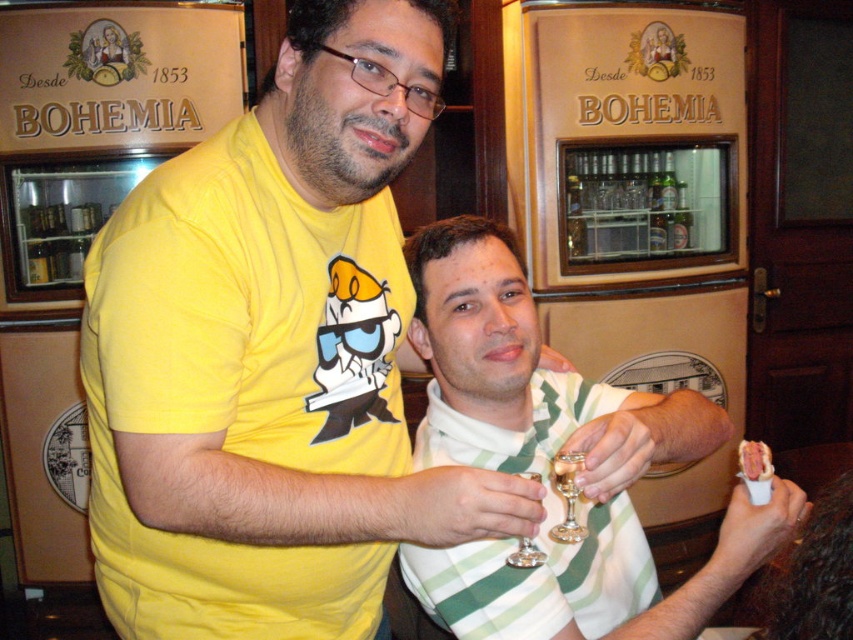
Is green striped shirt at center wider than transparent glass at center?

Indeed, green striped shirt at center has a greater width compared to transparent glass at center.

Does point (459, 632) lie in front of point (538, 557)?

That is False.

I want to click on green striped shirt at center, so click(538, 531).

What are the coordinates of `green striped shirt at center` in the screenshot? It's located at (538, 531).

At what (x,y) coordinates should I click in order to perform the action: click on clear glass bottles at center. Please return your answer as a coordinate pair (x, y). Image resolution: width=853 pixels, height=640 pixels. Looking at the image, I should click on (624, 205).

Who is lower down, clear glass bottles at center or clear glass wine glass at center?

clear glass wine glass at center is below.

Describe the element at coordinates (624, 205) in the screenshot. This screenshot has width=853, height=640. I see `clear glass bottles at center` at that location.

Where is `clear glass bottles at center`? This screenshot has height=640, width=853. clear glass bottles at center is located at coordinates (x=624, y=205).

I want to click on white striped shirt at center, so tap(552, 458).

Between white striped shirt at center and green striped shirt at center, which one appears on the right side from the viewer's perspective?

green striped shirt at center is more to the right.

The image size is (853, 640). Identify the location of white striped shirt at center. (552, 458).